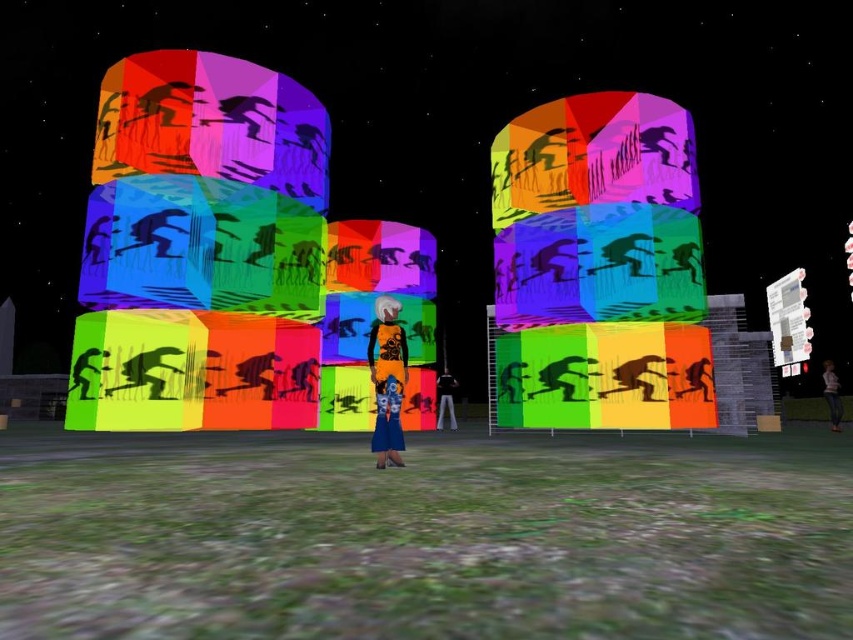
Question: Estimate the real-world distances between objects in this image. Which object is farther from the matte black pants at center?

Choices:
 (A) denim pants at center
 (B) orange fabric dress at center

Answer: (B)

Question: Observing the image, what is the correct spatial positioning of orange fabric dress at center in reference to matte black pants at center?

Choices:
 (A) left
 (B) right

Answer: (A)

Question: Can you confirm if matte black pants at center is positioned above denim pants at center?

Choices:
 (A) yes
 (B) no

Answer: (B)

Question: Among these points, which one is farthest from the camera?

Choices:
 (A) (442, 416)
 (B) (827, 365)

Answer: (A)

Question: Is orange fabric dress at center to the left of denim pants at center from the viewer's perspective?

Choices:
 (A) yes
 (B) no

Answer: (A)

Question: Which object appears farthest from the camera in this image?

Choices:
 (A) denim pants at center
 (B) matte black pants at center

Answer: (B)